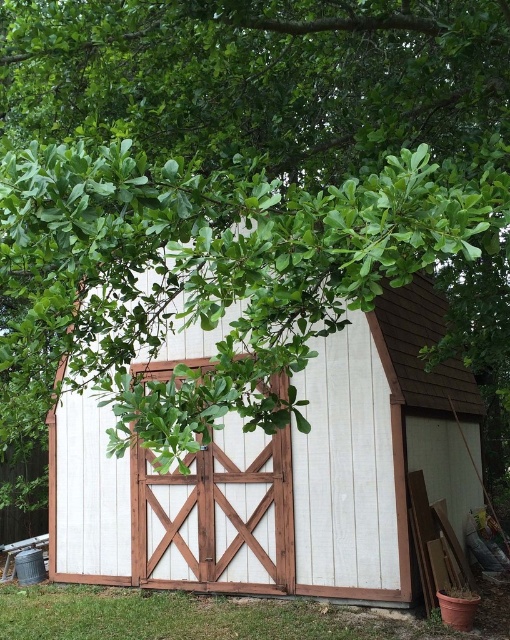
How much distance is there between white wood barn at center and white wood barn door at center?

They are 25.45 inches apart.

How far apart are white wood barn at center and white wood barn door at center?

white wood barn at center and white wood barn door at center are 25.45 inches apart.

The image size is (510, 640). I want to click on white wood barn at center, so click(x=282, y=476).